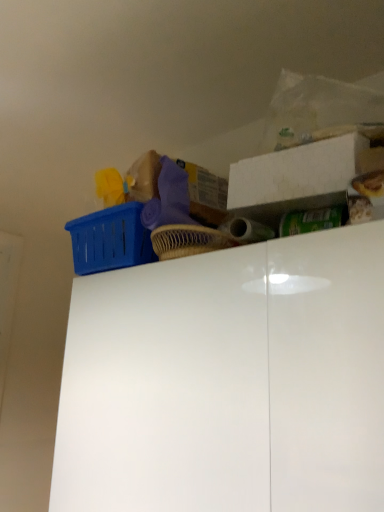
Question: Is white glossy cabinet at upper center positioned far away from white matte storage box at upper right?

Choices:
 (A) yes
 (B) no

Answer: (B)

Question: Considering the relative positions of white glossy cabinet at upper center and white matte storage box at upper right in the image provided, is white glossy cabinet at upper center to the left of white matte storage box at upper right from the viewer's perspective?

Choices:
 (A) yes
 (B) no

Answer: (A)

Question: Is white glossy cabinet at upper center positioned before white matte storage box at upper right?

Choices:
 (A) yes
 (B) no

Answer: (A)

Question: From a real-world perspective, is white glossy cabinet at upper center under white matte storage box at upper right?

Choices:
 (A) yes
 (B) no

Answer: (A)

Question: Considering the relative sizes of white glossy cabinet at upper center and white matte storage box at upper right in the image provided, is white glossy cabinet at upper center shorter than white matte storage box at upper right?

Choices:
 (A) yes
 (B) no

Answer: (B)

Question: Is white glossy cabinet at upper center directly adjacent to white matte storage box at upper right?

Choices:
 (A) yes
 (B) no

Answer: (B)

Question: Is white matte storage box at upper right positioned behind white glossy cabinet at upper center?

Choices:
 (A) no
 (B) yes

Answer: (B)

Question: Is white matte storage box at upper right completely or partially outside of white glossy cabinet at upper center?

Choices:
 (A) yes
 (B) no

Answer: (A)

Question: Are white matte storage box at upper right and white glossy cabinet at upper center far apart?

Choices:
 (A) no
 (B) yes

Answer: (A)

Question: From a real-world perspective, is white matte storage box at upper right on white glossy cabinet at upper center?

Choices:
 (A) no
 (B) yes

Answer: (B)

Question: Is white matte storage box at upper right to the left of white glossy cabinet at upper center from the viewer's perspective?

Choices:
 (A) no
 (B) yes

Answer: (A)

Question: Is white matte storage box at upper right beside white glossy cabinet at upper center?

Choices:
 (A) no
 (B) yes

Answer: (A)

Question: Is white glossy cabinet at upper center wider or thinner than white matte storage box at upper right?

Choices:
 (A) thin
 (B) wide

Answer: (B)